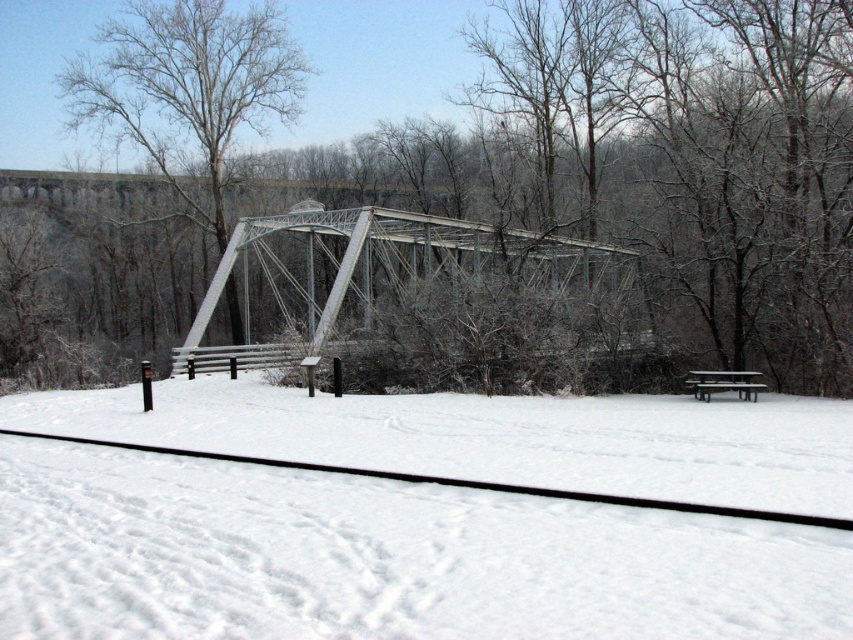
You are a railway inspector checking the winter conditions. You notice the white snow at center and the metallic gray bridge at center. Which one has a smaller thickness?

The white snow at center is thinner than the metallic gray bridge at center, so the white snow at center has a smaller thickness.

You are standing at the point marked as point (x=187, y=88) in the winter scene. What object are you standing on?

You are standing on a bare wood tree at upper center.